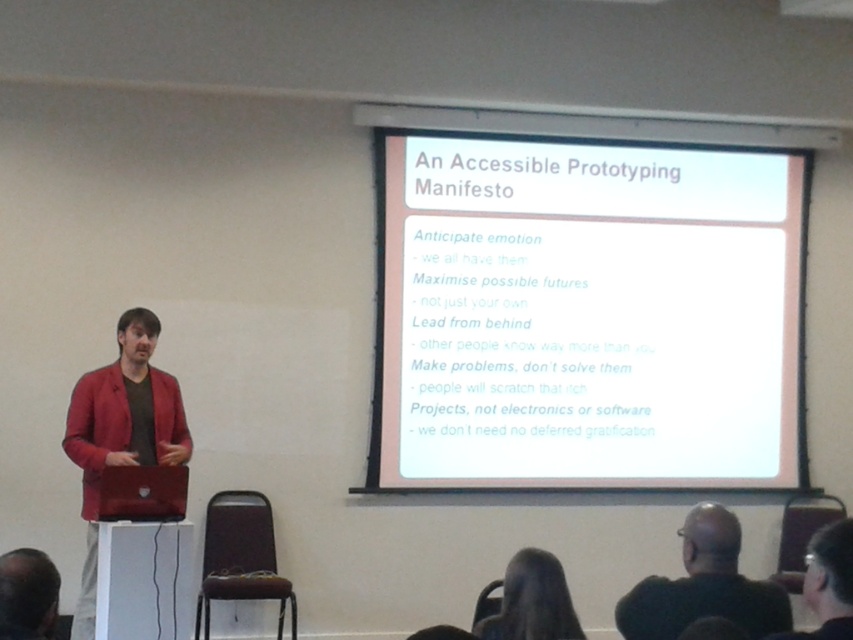
Is point (776, 627) farther from viewer compared to point (38, 592)?

Yes, it is.

Is dark green sweater at lower right taller than dark brown hair at lower left?

Indeed, dark green sweater at lower right has a greater height compared to dark brown hair at lower left.

At what (x,y) coordinates should I click in order to perform the action: click on dark green sweater at lower right. Please return your answer as a coordinate pair (x, y). Looking at the image, I should click on (704, 586).

Describe the element at coordinates (120, 433) in the screenshot. This screenshot has height=640, width=853. I see `matte red jacket at left` at that location.

Which is below, matte red jacket at left or dark green sweater at lower right?

dark green sweater at lower right is lower down.

What are the coordinates of `matte red jacket at left` in the screenshot? It's located at (120, 433).

Is matte red jacket at left positioned before dark hair at lower center?

No, it is behind dark hair at lower center.

Does point (86, 588) come in front of point (570, 604)?

That is False.

Where is `matte red jacket at left`? matte red jacket at left is located at coordinates (120, 433).